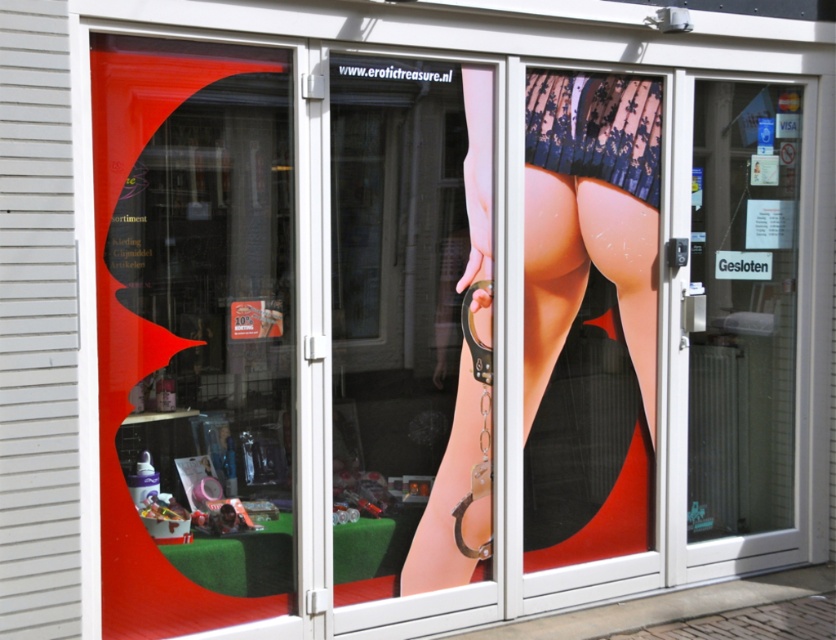
Does transparent glass door at center appear over lacy black underwear at center?

No.

Where is `transparent glass door at center`? Image resolution: width=836 pixels, height=640 pixels. transparent glass door at center is located at coordinates [752, 317].

How much distance is there between smooth skin at center and lacy black underwear at center?

→ smooth skin at center and lacy black underwear at center are 7.37 inches apart.

Can you confirm if smooth skin at center is thinner than lacy black underwear at center?

No.

Is point (563, 253) farther from camera compared to point (643, 129)?

That is False.

This screenshot has width=836, height=640. In order to click on smooth skin at center in this screenshot , I will do `click(589, 218)`.

Can you confirm if transparent glass door at center is positioned to the left of smooth skin at center?

Incorrect, transparent glass door at center is not on the left side of smooth skin at center.

Is point (768, 428) positioned after point (528, 321)?

Yes, it is.

Identify the location of transparent glass door at center. (752, 317).